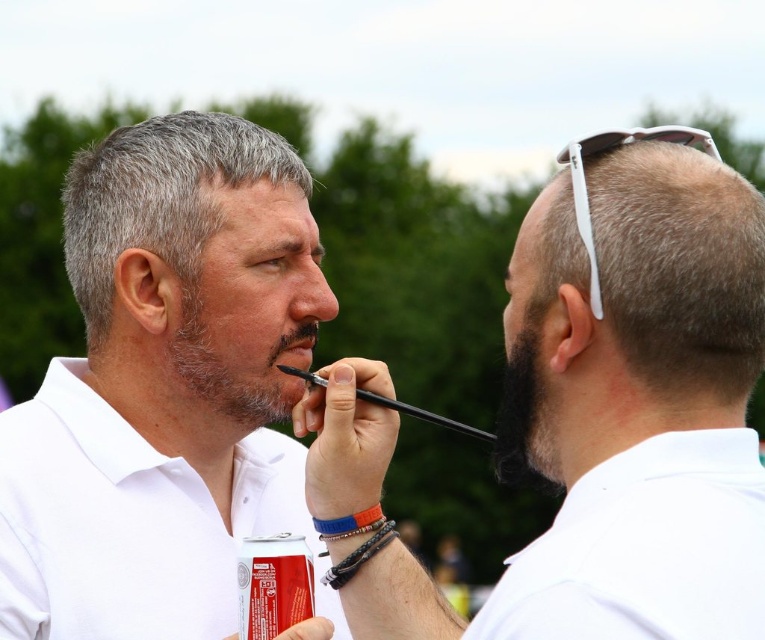
Does white matte shirt at center have a larger size compared to dark brown hair at upper center?

Indeed, white matte shirt at center has a larger size compared to dark brown hair at upper center.

What do you see at coordinates (155, 400) in the screenshot? I see `white matte shirt at center` at bounding box center [155, 400].

Where is `white matte shirt at center`? Image resolution: width=765 pixels, height=640 pixels. white matte shirt at center is located at coordinates coord(155,400).

Consider the image. Who is taller, red matte can at lower left or smooth skin at center?

Standing taller between the two is red matte can at lower left.

Measure the distance between red matte can at lower left and camera.

The distance of red matte can at lower left from camera is 7.89 feet.

What are the coordinates of `red matte can at lower left` in the screenshot? It's located at (272, 584).

Who is positioned more to the left, gray beard at center or dark brown hair at upper center?

gray beard at center

Measure the distance between gray beard at center and dark brown hair at upper center.

The distance of gray beard at center from dark brown hair at upper center is 3.60 inches.

Which is in front, point (308, 332) or point (280, 257)?

Point (280, 257)

Find the location of a particular element. The image size is (765, 640). gray beard at center is located at coordinates (249, 308).